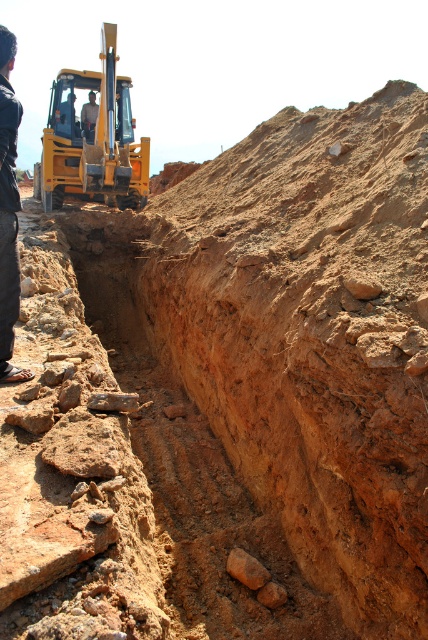
Question: Which object appears farthest from the camera in this image?

Choices:
 (A) yellow metallic excavator at upper left
 (B) brown rough rock at center
 (C) dark blue shirt at left

Answer: (A)

Question: Does dark blue shirt at left appear on the right side of brown rough rock at center?

Choices:
 (A) yes
 (B) no

Answer: (B)

Question: Can you confirm if dark blue shirt at left is positioned to the right of brown rough rock at center?

Choices:
 (A) no
 (B) yes

Answer: (A)

Question: Which point is closer to the camera?

Choices:
 (A) (64, 92)
 (B) (0, 364)
 (C) (255, 580)

Answer: (B)

Question: In this image, where is yellow metallic excavator at upper left located relative to brown rough rock at center?

Choices:
 (A) left
 (B) right

Answer: (A)

Question: Which of the following is the farthest from the observer?

Choices:
 (A) (98, 120)
 (B) (231, 576)
 (C) (12, 275)

Answer: (A)